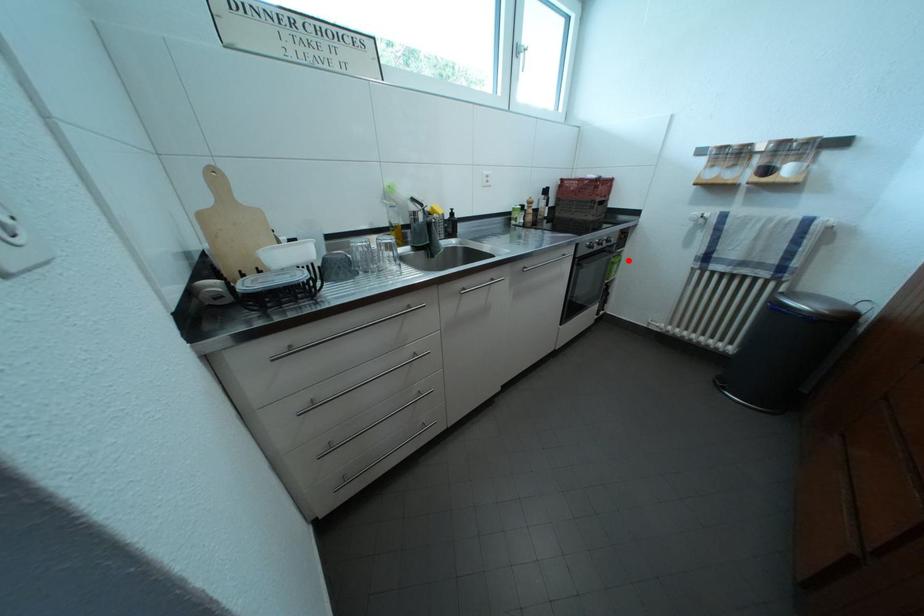
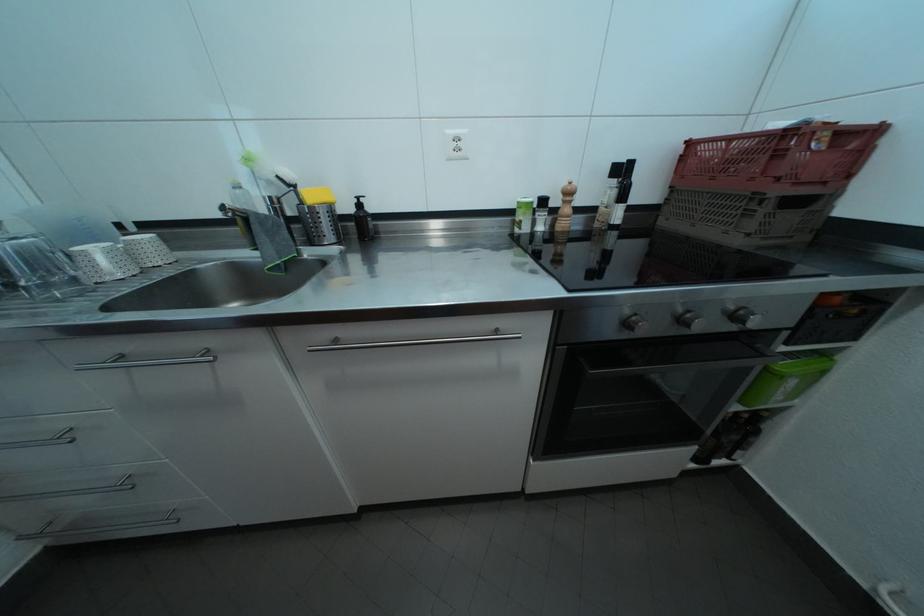
Where in the second image is the point corresponding to the highlighted location from the first image?

(833, 360)